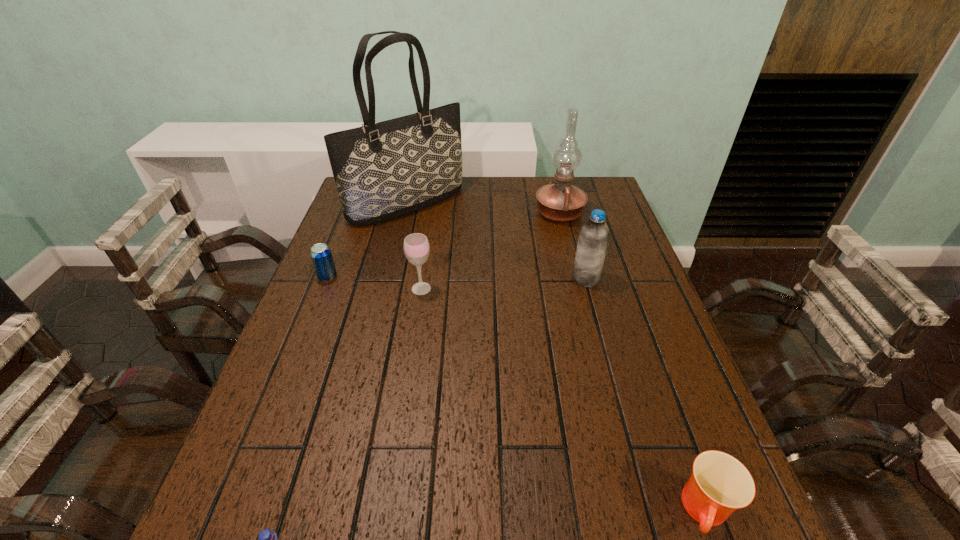
Locate an element on the screen. The width and height of the screenshot is (960, 540). vacant area at the left edge of the desktop is located at coordinates (353, 328).

Locate an element on the screen. free space at the right edge is located at coordinates (661, 440).

This screenshot has height=540, width=960. In order to click on vacant space at the near right corner of the desktop in this screenshot , I will do `click(687, 534)`.

Identify the location of vacant area between the fourth shortest object and the third tallest object. (503, 284).

You are a GUI agent. You are given a task and a screenshot of the screen. Output one action in this format:
    pyautogui.click(x=<x>, y=<y>)
    Task: Click on the free spot between the beer can and the oil lamp
    
    Given the screenshot: What is the action you would take?
    pyautogui.click(x=444, y=245)

The height and width of the screenshot is (540, 960). I want to click on free space between the fourth shortest object and the beer can, so (374, 282).

This screenshot has width=960, height=540. What are the coordinates of `object that stands as the second closest to the cup` in the screenshot? It's located at (267, 539).

You are a GUI agent. You are given a task and a screenshot of the screen. Output one action in this format:
    pyautogui.click(x=<x>, y=<y>)
    Task: Click on the closest object to the beer can
    This screenshot has width=960, height=540.
    Given the screenshot: What is the action you would take?
    pyautogui.click(x=383, y=170)

You are a GUI agent. You are given a task and a screenshot of the screen. Output one action in this format:
    pyautogui.click(x=<x>, y=<y>)
    Task: Click on the vacant space that satisfies the following two spatial constraints: 1. on the front side of the fourth tallest object; 2. on the right side of the tallest object
    The height and width of the screenshot is (540, 960).
    Given the screenshot: What is the action you would take?
    pyautogui.click(x=387, y=288)

Where is `free space that satisfies the following two spatial constraints: 1. on the back side of the oil lamp; 2. on the right side of the wineglass`? free space that satisfies the following two spatial constraints: 1. on the back side of the oil lamp; 2. on the right side of the wineglass is located at coordinates (433, 213).